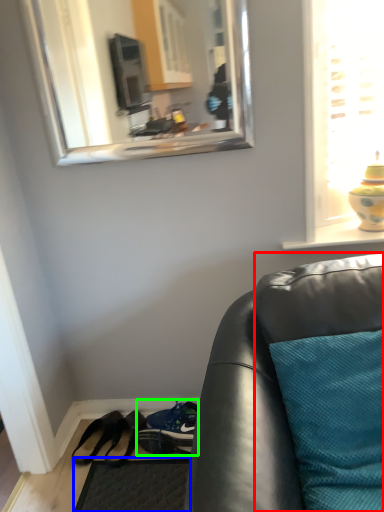
Question: Which is nearer to the cushion (highlighted by a red box)? flat (highlighted by a blue box) or shoe (highlighted by a green box).

Choices:
 (A) flat
 (B) shoe

Answer: (B)